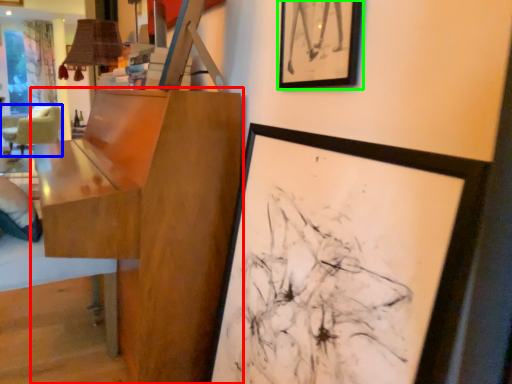
Question: Estimate the real-world distances between objects in this image. Which object is farther from table (highlighted by a red box), chair (highlighted by a blue box) or picture frame (highlighted by a green box)?

Choices:
 (A) chair
 (B) picture frame

Answer: (A)